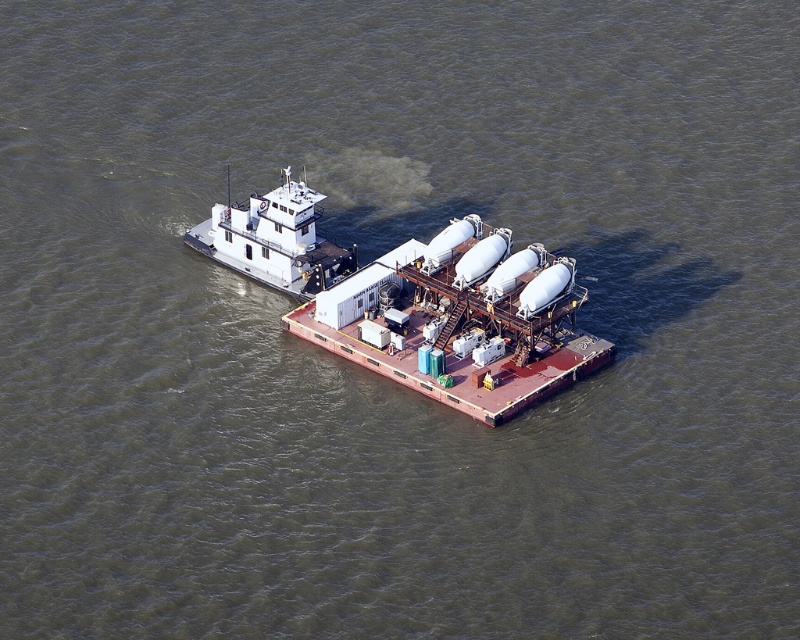
Question: Which point appears farthest from the camera in this image?

Choices:
 (A) (384, 300)
 (B) (218, 228)

Answer: (B)

Question: Does white matte tankers at center have a greater width compared to white matte boat at center?

Choices:
 (A) no
 (B) yes

Answer: (B)

Question: Which object is farther from the camera taking this photo?

Choices:
 (A) white matte boat at center
 (B) white matte tankers at center

Answer: (A)

Question: Which of the following is the farthest from the observer?

Choices:
 (A) (376, 352)
 (B) (206, 227)

Answer: (B)

Question: Considering the relative positions of white matte tankers at center and white matte boat at center in the image provided, where is white matte tankers at center located with respect to white matte boat at center?

Choices:
 (A) below
 (B) above

Answer: (A)

Question: From the image, what is the correct spatial relationship of white matte tankers at center in relation to white matte boat at center?

Choices:
 (A) right
 (B) left

Answer: (A)